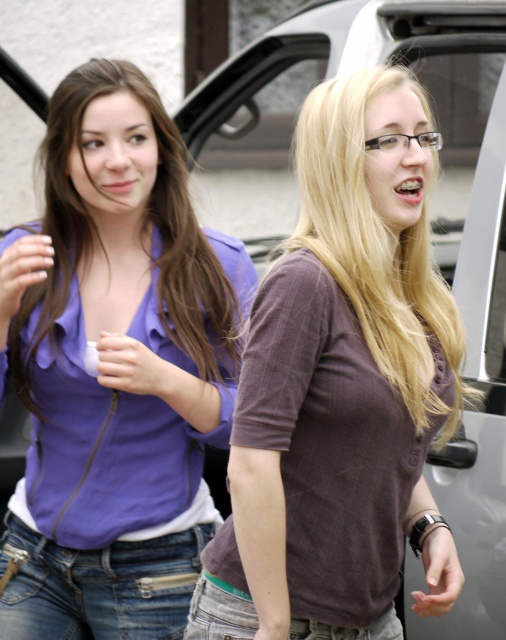
You are a photographer standing 1.5 meters away from the camera. You want to adjust the purple satin blouse at upper left. Can you reach it without moving closer?

The distance between the purple satin blouse at upper left and the camera is 2.91 meters. Since you are already 1.5 meters away from the camera, the total distance between you and the purple satin blouse at upper left is 4.41 meters. You cannot reach it without moving closer.

You are a fashion designer analyzing the clothing items in the image. Which clothing item is narrower in width between the matte purple blouse at center and the denim jeans at lower center?

The matte purple blouse at center is thinner than the denim jeans at lower center, so the matte purple blouse at center is narrower in width.

You are a photographer trying to capture the purple satin blouse at upper left in the center of your photo. Given its current position at point 0.578 on the horizontal axis and 0.227 on the vertical axis, will you need to adjust your camera to the left or right to center it horizontally?

The purple satin blouse at upper left is located at point 0.578 on the horizontal axis. Since the center of the photo is at 0.5, you need to adjust your camera slightly to the right to center it horizontally.